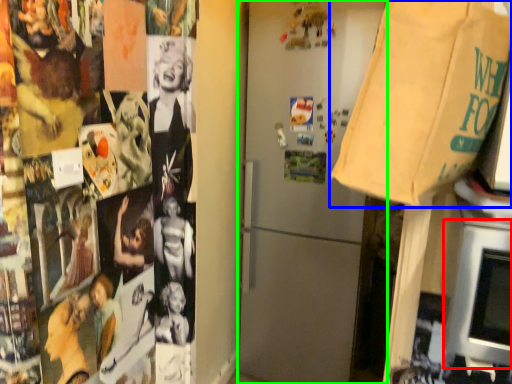
Question: Which is nearer to the oven (highlighted by a red box)? grocery bag (highlighted by a blue box) or refrigerator (highlighted by a green box).

Choices:
 (A) grocery bag
 (B) refrigerator

Answer: (A)